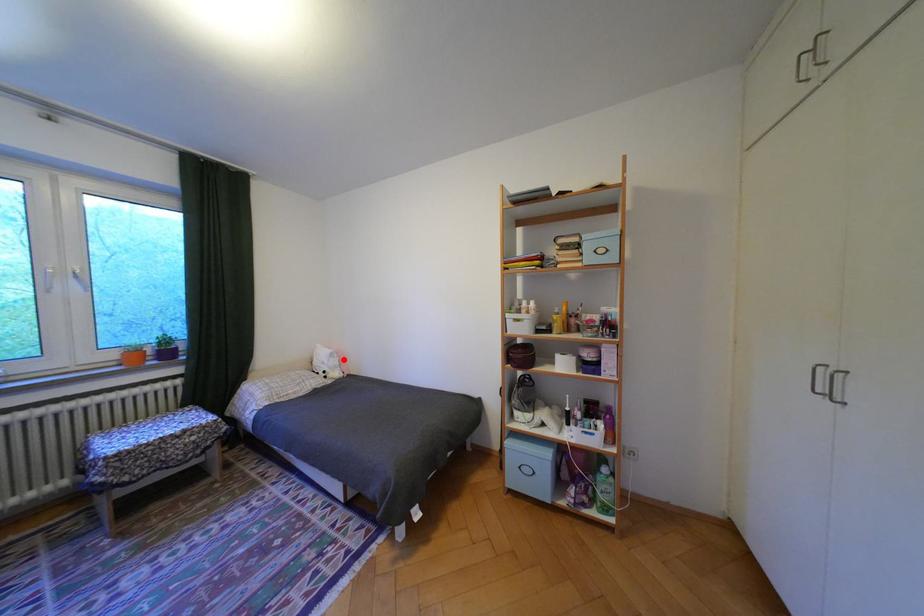
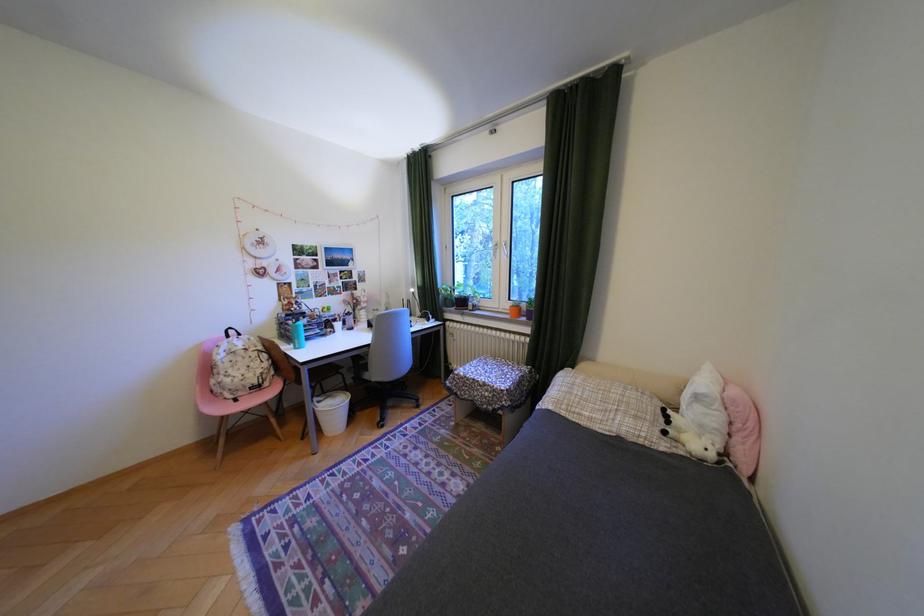
Locate, in the second image, the point that corresponds to the highlighted location in the first image.

(710, 408)